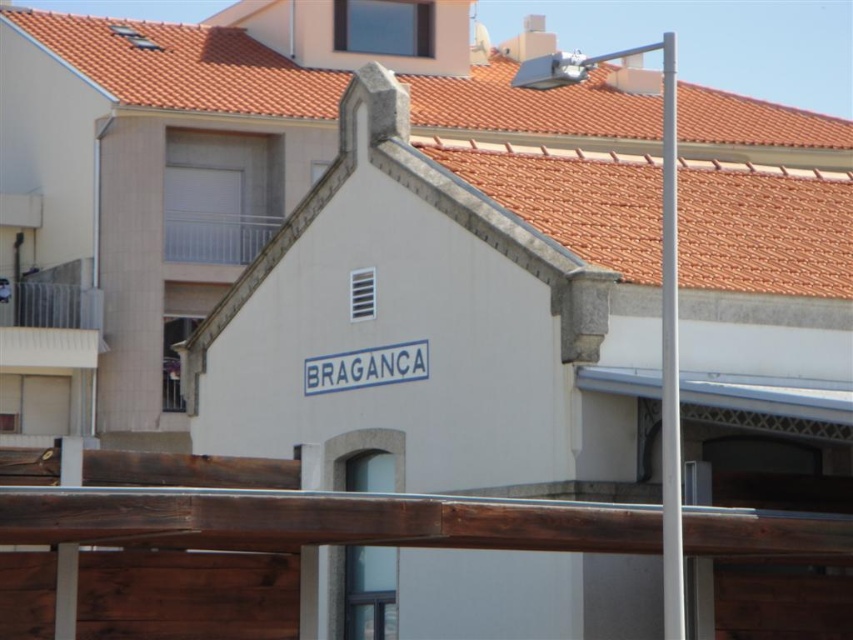
Can you confirm if brown wooden rail at lower center is positioned to the right of white metallic pole at right?

No, brown wooden rail at lower center is not to the right of white metallic pole at right.

Does brown wooden rail at lower center have a lesser height compared to white metallic pole at right?

Indeed, brown wooden rail at lower center has a lesser height compared to white metallic pole at right.

Is point (693, 529) positioned behind point (675, 492)?

Yes, it is.

I want to click on brown wooden rail at lower center, so click(320, 518).